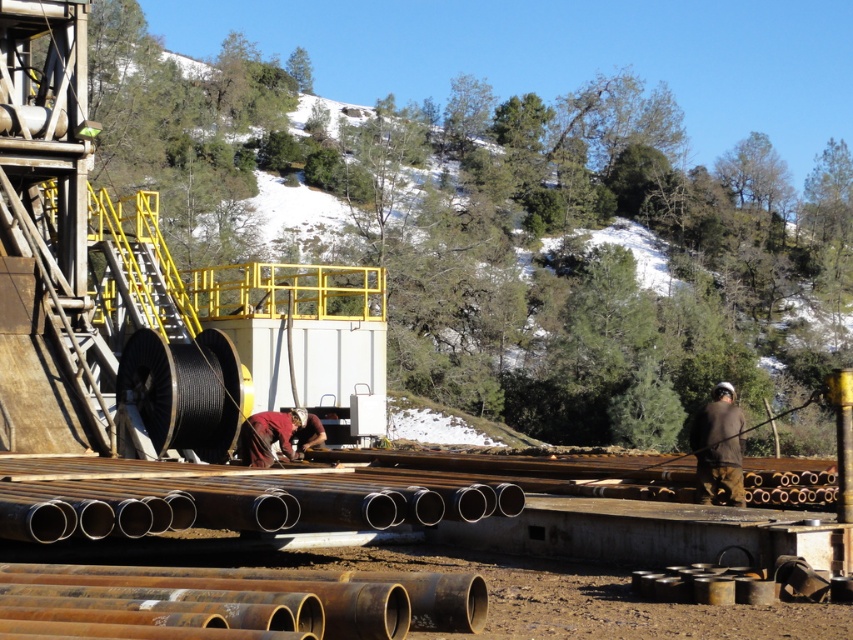
Question: Which object is farther from the camera taking this photo?

Choices:
 (A) polished metallic pipes at center
 (B) brown fabric jacket at right
 (C) maroon fabric shirt at center

Answer: (C)

Question: Does brown fabric jacket at right have a lesser width compared to maroon fabric shirt at center?

Choices:
 (A) no
 (B) yes

Answer: (A)

Question: Which point is farther to the camera?

Choices:
 (A) (250, 433)
 (B) (476, 493)

Answer: (A)

Question: Is polished metallic pipes at center smaller than brown fabric jacket at right?

Choices:
 (A) no
 (B) yes

Answer: (B)

Question: Considering the relative positions of polished metallic pipes at center and brown fabric jacket at right in the image provided, where is polished metallic pipes at center located with respect to brown fabric jacket at right?

Choices:
 (A) left
 (B) right

Answer: (A)

Question: Among these objects, which one is farthest from the camera?

Choices:
 (A) maroon fabric shirt at center
 (B) polished metallic pipes at center
 (C) brown fabric jacket at right

Answer: (A)